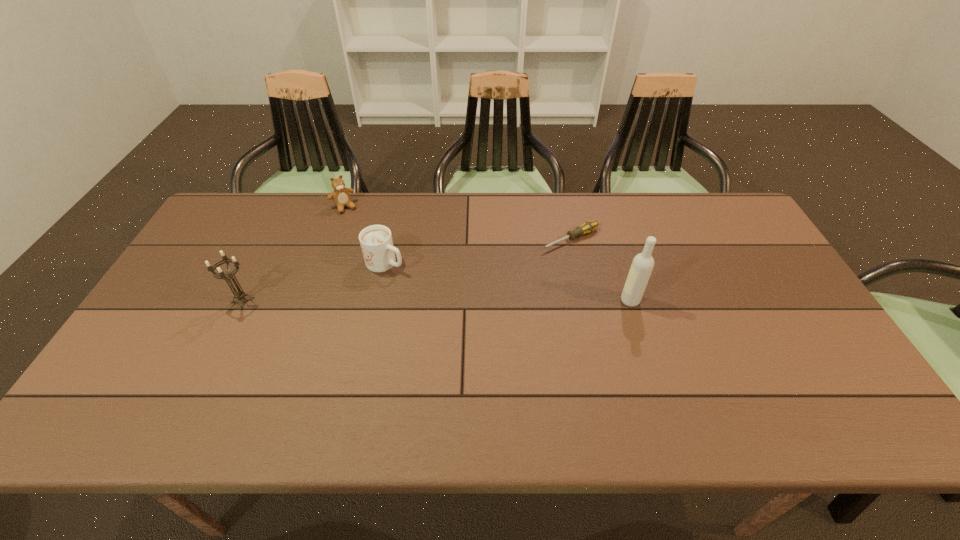
Find the location of a particular element. Image resolution: width=960 pixels, height=540 pixels. screwdriver that is at the far edge is located at coordinates (587, 227).

In order to click on teddy bear located at the far edge in this screenshot , I will do `click(341, 195)`.

Identify the location of free space at the far edge of the desktop. The image size is (960, 540). (329, 207).

You are a GUI agent. You are given a task and a screenshot of the screen. Output one action in this format:
    pyautogui.click(x=<x>, y=<y>)
    Task: Click on the free spot at the left edge of the desktop
    The width and height of the screenshot is (960, 540).
    Given the screenshot: What is the action you would take?
    pyautogui.click(x=211, y=254)

This screenshot has width=960, height=540. Identify the location of free region at the right edge of the desktop. (781, 277).

Identify the location of free space at the far left corner. The image size is (960, 540). pyautogui.click(x=233, y=205).

The image size is (960, 540). In order to click on vacant space at the far right corner of the desktop in this screenshot , I will do `click(730, 219)`.

The width and height of the screenshot is (960, 540). I want to click on blank space at the near right corner, so click(x=820, y=375).

Where is `free space between the third object from right to left and the tallest object`? free space between the third object from right to left and the tallest object is located at coordinates (508, 282).

Locate an element on the screen. Image resolution: width=960 pixels, height=540 pixels. free space between the third object from right to left and the second object from right to left is located at coordinates (478, 251).